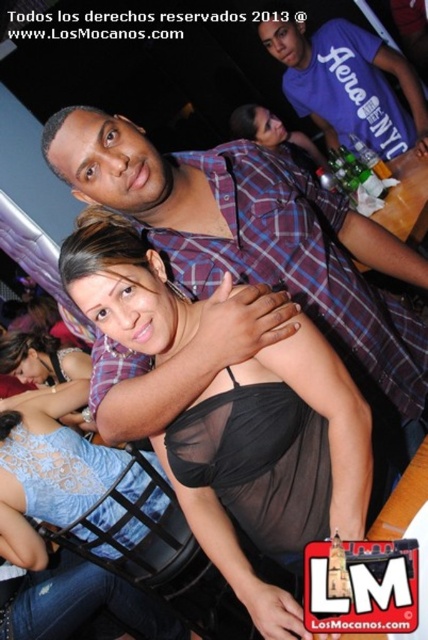
You are at a party and want to take a photo of the two points in the scene. The first point is at coordinates point (211, 358) and the second is at point (291, 35). Which point is closer to you when you take the photo?

Point (211, 358) is closer to the viewer than point (291, 35).